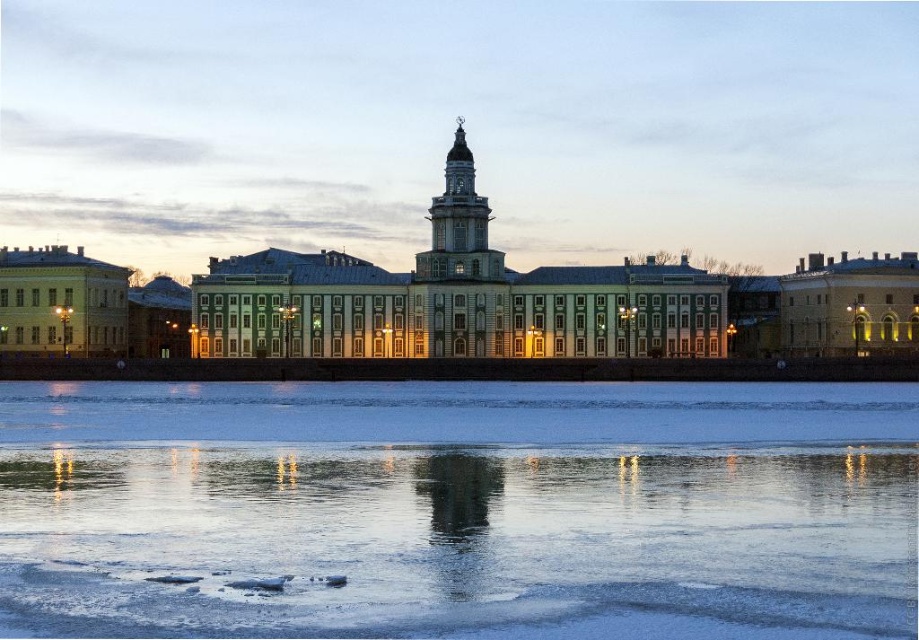
You are an architect examining the grand structure. You notice the translucent ice at lower center and the light gray stone tower at center. Which object occupies a greater area in the image?

The translucent ice at lower center is larger in size than the light gray stone tower at center, so it occupies a greater area in the image.

You are an architect analyzing the structure in the image. You observe the translucent ice at lower center and the white stone building at center. Which object is taller?

The white stone building at center is taller than the translucent ice at lower center.

Based on the scene description, where is the translucent ice at lower center located in terms of its 2D coordinates?

The translucent ice at lower center is located at the 2D coordinates of point (x=460, y=502).